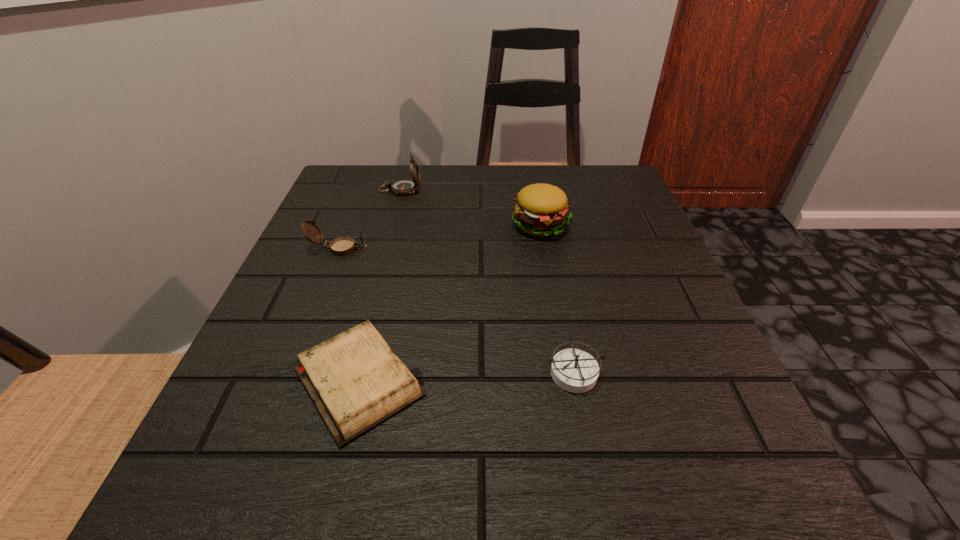
You are a GUI agent. You are given a task and a screenshot of the screen. Output one action in this format:
    pyautogui.click(x=<x>, y=<y>)
    Task: Click on the object present at the far right corner
    
    Given the screenshot: What is the action you would take?
    pyautogui.click(x=541, y=210)

Find the location of a particular element. The width and height of the screenshot is (960, 540). free space at the far edge is located at coordinates (479, 191).

The width and height of the screenshot is (960, 540). I want to click on free space at the near edge of the desktop, so click(586, 505).

The width and height of the screenshot is (960, 540). In order to click on vacant area at the left edge in this screenshot , I will do `click(313, 317)`.

Locate an element on the screen. vacant space at the right edge is located at coordinates (725, 368).

I want to click on vacant region at the far left corner, so click(x=388, y=216).

Where is `free region at the near left corner of the desktop`? free region at the near left corner of the desktop is located at coordinates (178, 496).

Identify the location of free space at the far right corner of the desktop. The image size is (960, 540). (589, 196).

In the image, there is a desktop. Where is `vacant space at the near right corner`? This screenshot has height=540, width=960. vacant space at the near right corner is located at coordinates coord(739,449).

What are the coordinates of `free space that is in between the farthest compass and the diary` in the screenshot? It's located at (379, 285).